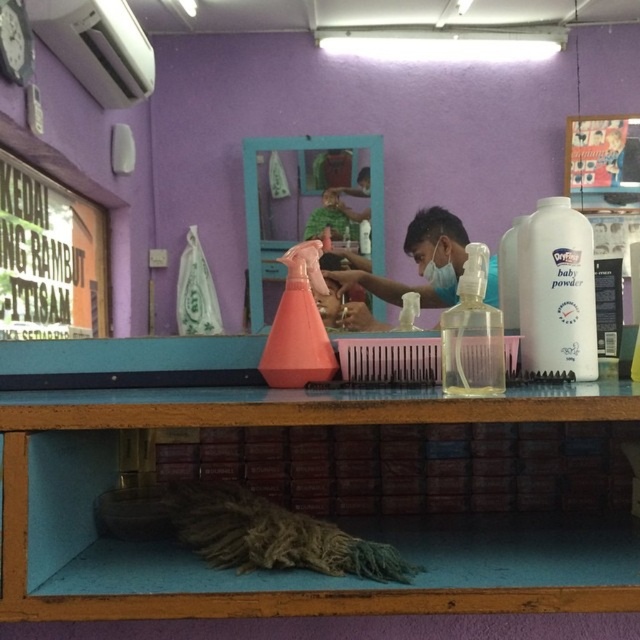
Question: Can you confirm if wooden at lower center is smaller than clear plastic spray bottle at center?

Choices:
 (A) no
 (B) yes

Answer: (A)

Question: Which object is positioned farthest from the clear plastic spray bottle at center?

Choices:
 (A) white plastic baby powder at right
 (B) transparent plastic bottle at center
 (C) wooden at lower center

Answer: (B)

Question: Which point is closer to the camera?

Choices:
 (A) wooden at lower center
 (B) white plastic baby powder at right

Answer: (A)

Question: Does wooden at lower center have a smaller size compared to clear plastic spray bottle at center?

Choices:
 (A) yes
 (B) no

Answer: (B)

Question: Which point appears closest to the camera in this image?

Choices:
 (A) (468, 288)
 (B) (461, 257)
 (C) (577, 252)
 (D) (512, 536)

Answer: (A)

Question: Can you confirm if transparent plastic bottle at center is wider than clear plastic spray bottle at center?

Choices:
 (A) no
 (B) yes

Answer: (B)